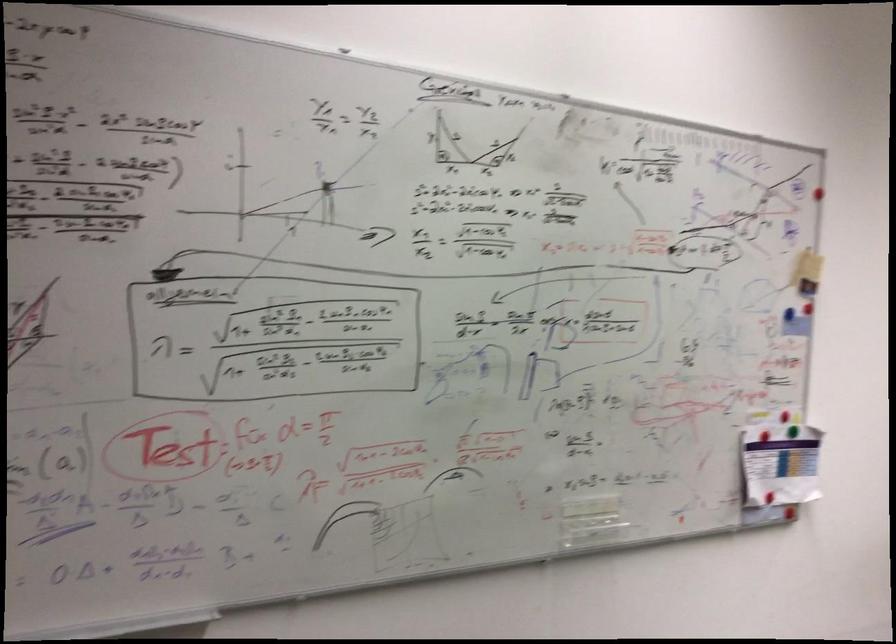
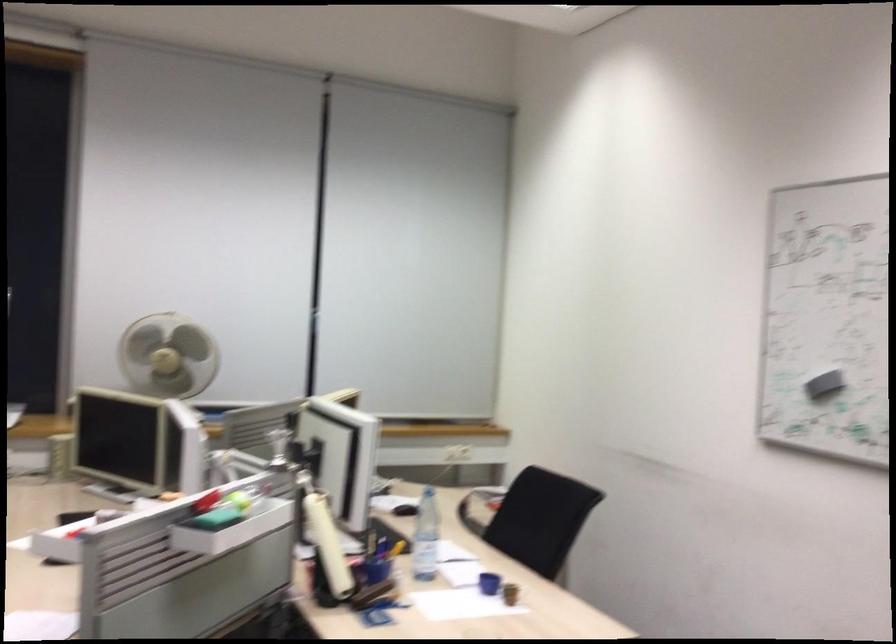
Question: The images are taken continuously from a first-person perspective. In which direction is your viewpoint rotating?

Choices:
 (A) Left
 (B) Right
 (C) Up
 (D) Down

Answer: (B)